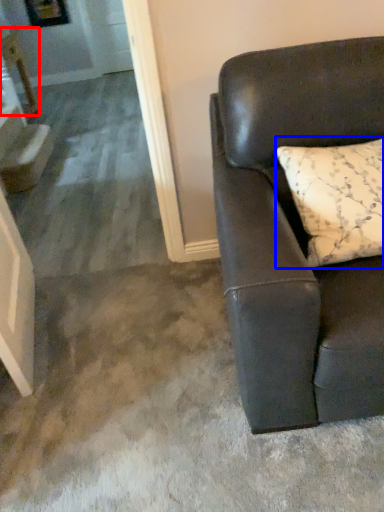
Question: Which point is closer to the camera, table (highlighted by a red box) or pillow (highlighted by a blue box)?

Choices:
 (A) table
 (B) pillow

Answer: (B)